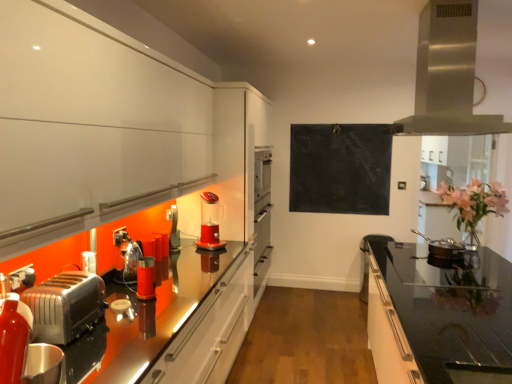
Question: Is shiny silver pan at right, marked as the 1th appliance in a right-to-left arrangement, outside black glass countertop at right?

Choices:
 (A) no
 (B) yes

Answer: (B)

Question: Is shiny silver pan at right, which is counted as the first appliance, starting from the back, positioned with its back to black glass countertop at right?

Choices:
 (A) yes
 (B) no

Answer: (B)

Question: Could you tell me if shiny silver pan at right, which is counted as the first appliance, starting from the back, is facing black glass countertop at right?

Choices:
 (A) no
 (B) yes

Answer: (A)

Question: Can you confirm if shiny silver pan at right, which is counted as the first appliance, starting from the back, is positioned to the right of black glass countertop at right?

Choices:
 (A) yes
 (B) no

Answer: (A)

Question: Does shiny silver pan at right, which is counted as the first appliance, starting from the back, have a larger size compared to black glass countertop at right?

Choices:
 (A) no
 (B) yes

Answer: (A)

Question: From the image's perspective, is translucent plastic blender at center above or below stainless steel range hood at upper right?

Choices:
 (A) above
 (B) below

Answer: (B)

Question: Is translucent plastic blender at center in front of or behind stainless steel range hood at upper right in the image?

Choices:
 (A) behind
 (B) front

Answer: (A)

Question: Is translucent plastic blender at center to the left or to the right of stainless steel range hood at upper right in the image?

Choices:
 (A) right
 (B) left

Answer: (B)

Question: In terms of height, does translucent plastic blender at center look taller or shorter compared to stainless steel range hood at upper right?

Choices:
 (A) tall
 (B) short

Answer: (B)

Question: Is black matte chalkboard at upper center spatially inside shiny silver pan at right, marked as the 1th appliance in a right-to-left arrangement, or outside of it?

Choices:
 (A) inside
 (B) outside

Answer: (B)

Question: Is black matte chalkboard at upper center to the left or to the right of shiny silver pan at right, marked as the 1th appliance in a right-to-left arrangement, in the image?

Choices:
 (A) right
 (B) left

Answer: (B)

Question: Considering the positions of black matte chalkboard at upper center and shiny silver pan at right, marked as the 1th appliance in a right-to-left arrangement, in the image, is black matte chalkboard at upper center taller or shorter than shiny silver pan at right, marked as the 1th appliance in a right-to-left arrangement,?

Choices:
 (A) tall
 (B) short

Answer: (A)

Question: From the image's perspective, is black matte chalkboard at upper center located above or below shiny silver pan at right, marked as the 1th appliance in a right-to-left arrangement?

Choices:
 (A) below
 (B) above

Answer: (B)

Question: Considering the positions of point (473, 178) and point (350, 145), is point (473, 178) closer or farther from the camera than point (350, 145)?

Choices:
 (A) closer
 (B) farther

Answer: (B)

Question: Is pink floral bouquet at right to the left or to the right of black matte chalkboard at upper center in the image?

Choices:
 (A) right
 (B) left

Answer: (A)